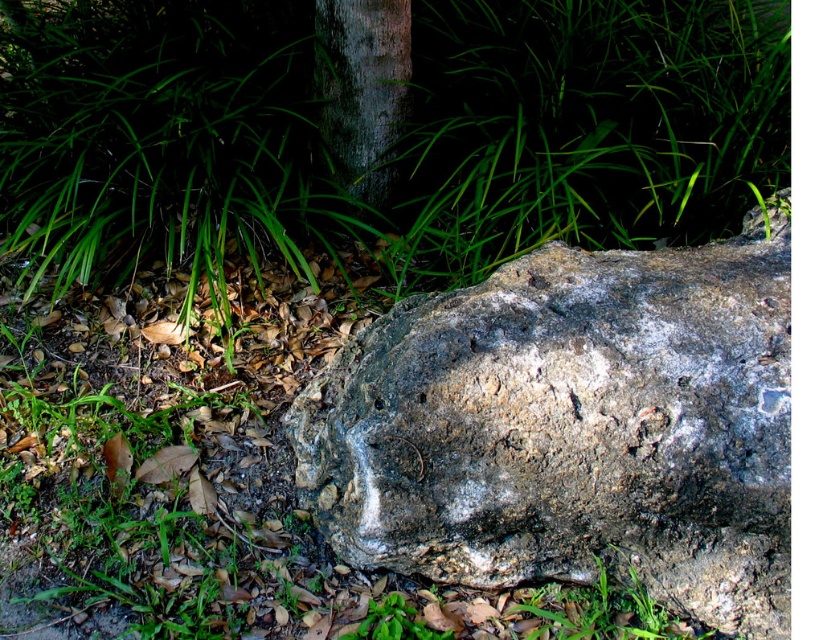
You are standing in the outdoor scene and want to place a small potted plant between the gray rough rock at center and the smooth gray bark at center. Based on their positions, which object should the plant be closer to?

The gray rough rock at center is in front of the smooth gray bark at center, so the plant should be placed closer to the smooth gray bark at center to ensure it is between them.

You are a hiker trying to place a small backpack between the gray rough rock at center and the smooth gray bark at center. Based on their widths, can you determine if there will be enough space for the backpack?

The gray rough rock at center might be wider than smooth gray bark at center, so there may not be enough space for the backpack if the total width of both objects exceeds the backpack placement area. However, the exact width comparison is uncertain based on the provided information.

You are standing in the outdoor scene with the large rock. You see two points marked on the rock surface. The first point is at coordinates point [477,328], and the second point is at point [366,176]. Which of these two points is nearer to you?

Point [477,328] is closer to the viewer than point [366,176].